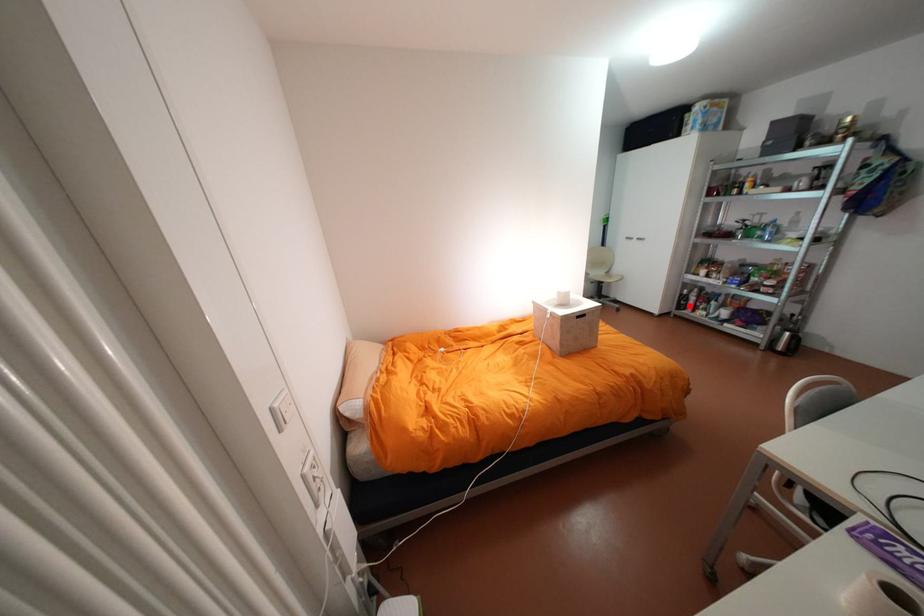
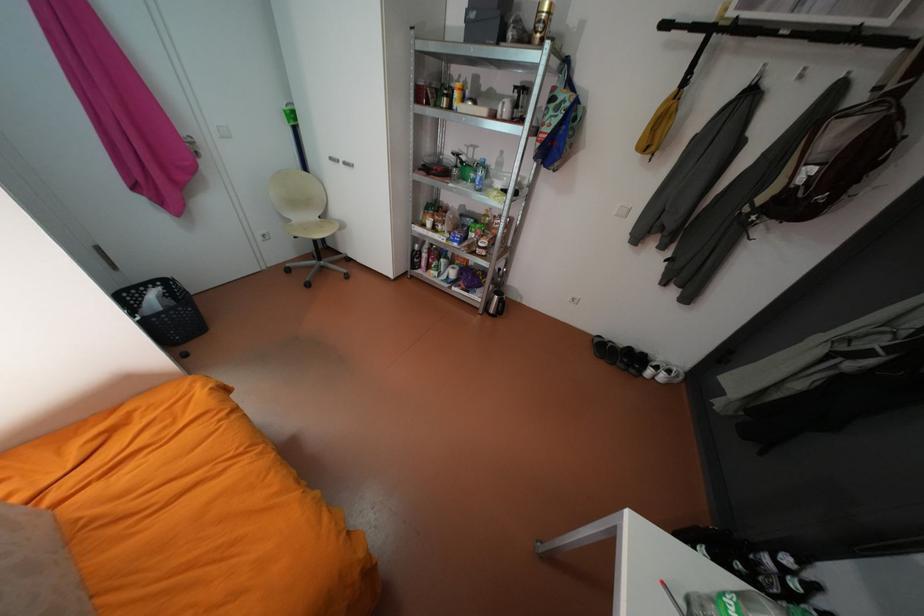
In the second image, find the point that corresponds to the highlighted location in the first image.

(423, 265)